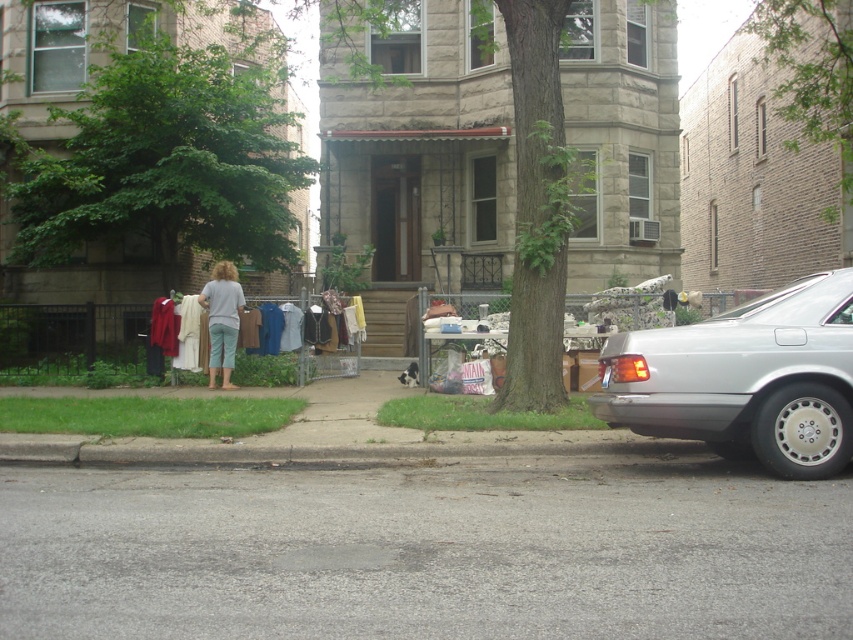
Question: Considering the real-world distances, which object is farthest from the white cotton shirts at center?

Choices:
 (A) green leafy tree at upper right
 (B) green leafy tree at left
 (C) gray asphalt pavement at lower center

Answer: (A)

Question: Which point is closer to the camera?

Choices:
 (A) (225, 328)
 (B) (107, 148)

Answer: (A)

Question: Is green leafy tree at center to the left of silver metallic car at right from the viewer's perspective?

Choices:
 (A) no
 (B) yes

Answer: (B)

Question: Is green leafy tree at left to the left of light blue denim shorts at center from the viewer's perspective?

Choices:
 (A) yes
 (B) no

Answer: (A)

Question: Does silver metallic car at right appear on the left side of green leafy tree at upper right?

Choices:
 (A) yes
 (B) no

Answer: (A)

Question: Which point is farther to the camera?

Choices:
 (A) green leafy tree at upper right
 (B) green leafy tree at center
 (C) light blue denim shorts at center
 (D) green leafy tree at left

Answer: (A)